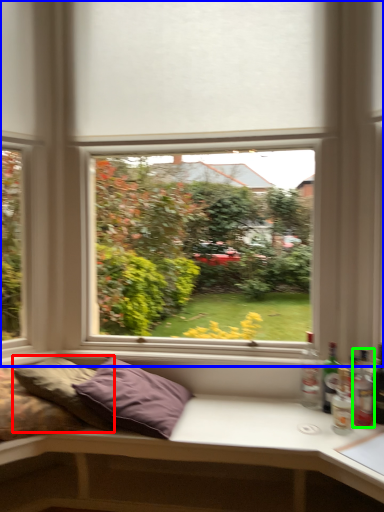
Question: Estimate the real-world distances between objects in this image. Which object is closer to pillow (highlighted by a red box), window (highlighted by a blue box) or bottle (highlighted by a green box)?

Choices:
 (A) window
 (B) bottle

Answer: (A)